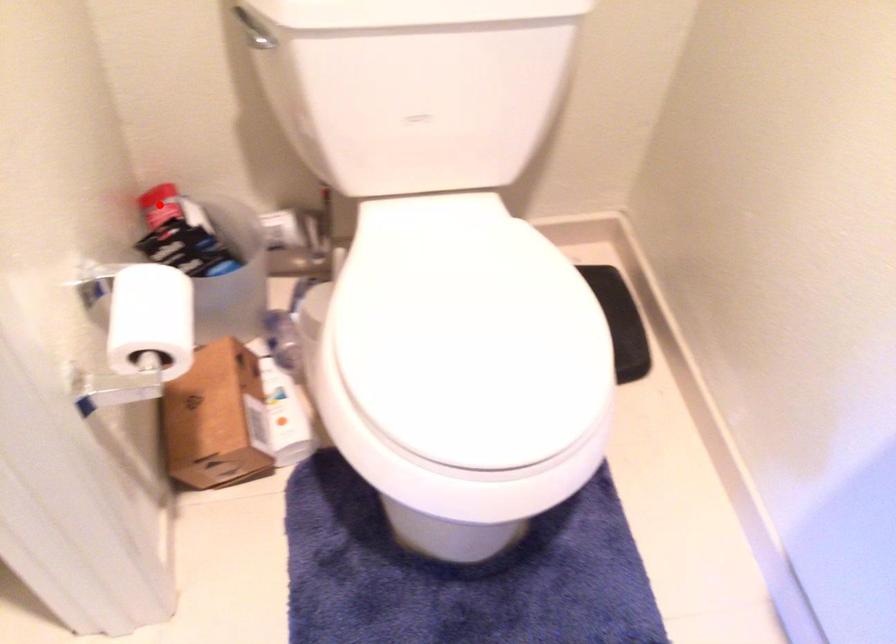
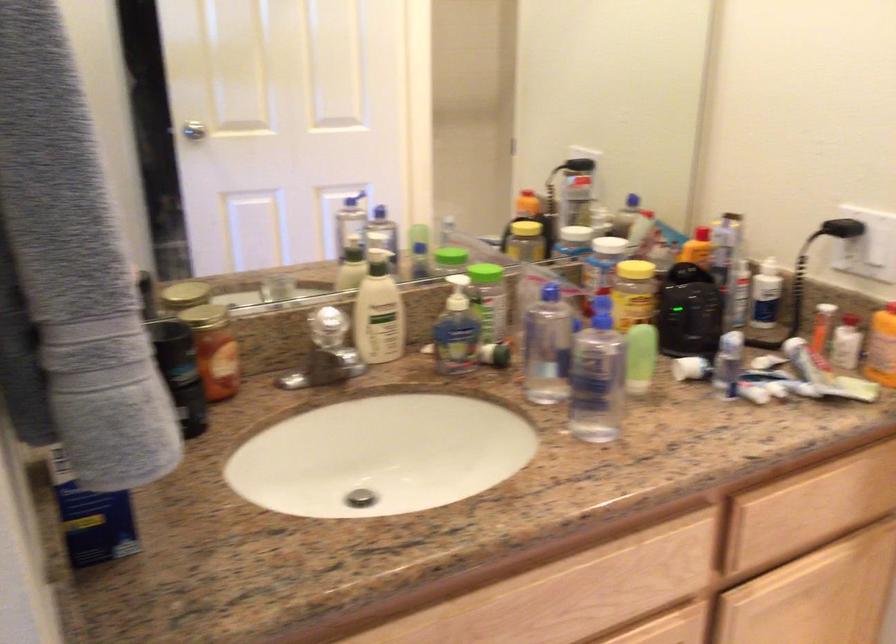
Question: I am providing you with two images of the same scene from different viewpoints. A red point is marked on the first image. At the location where the point appears in image 1, is it still visible in image 2?

Choices:
 (A) Yes
 (B) No

Answer: (B)